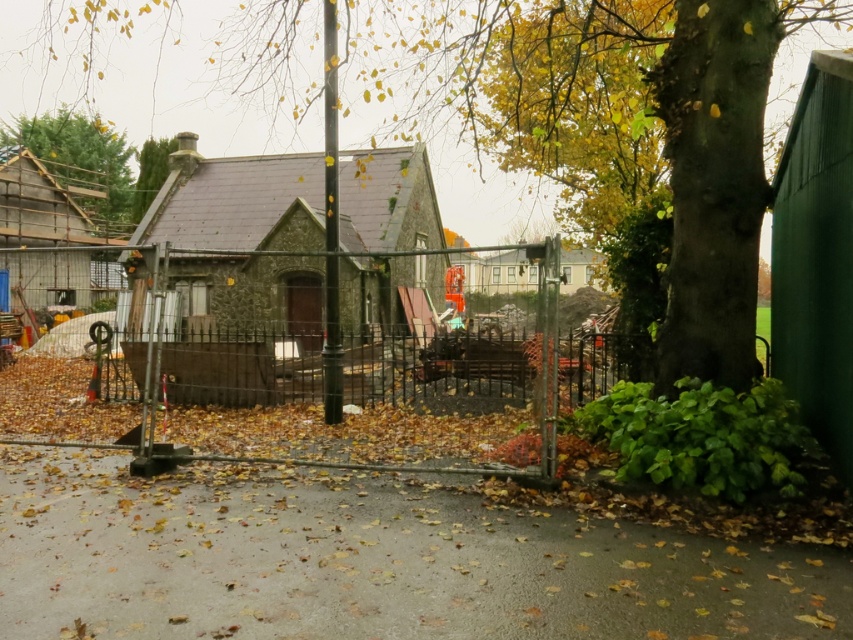
You are standing at the point closest to the camera in the image. Which of the two points, point [409,24] or point [86,209], is closer to you?

Point [409,24] is in front of point [86,209], so it is closer to you.

Consider the image. You are a painter standing on the driveway and want to paint the green rough bark tree at center and the green textured wood at upper left. Which object should you look upwards to paint first?

The green rough bark tree at center is located above the green textured wood at upper left, so you should look upwards to paint the green rough bark tree at center first.

You are a painter standing on the porch of the stone house. You want to paint both the green rough bark tree at center and the green textured wood at upper left. Which object will require you to look upward more?

The green rough bark tree at center is much taller than the green textured wood at upper left, so you will need to look upward more to paint the green rough bark tree at center.